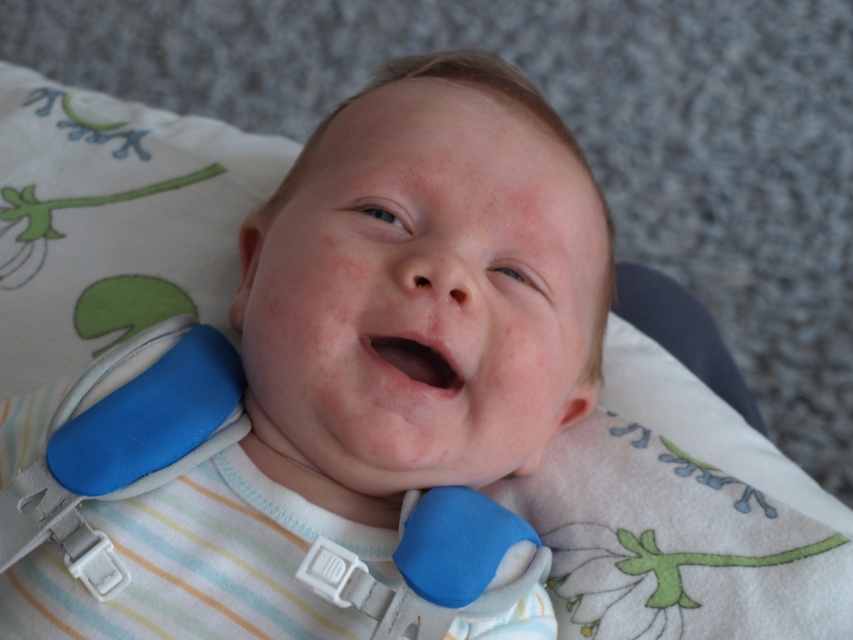
Question: Is blue foam baby at center to the left of blue foam strap at center from the viewer's perspective?

Choices:
 (A) no
 (B) yes

Answer: (A)

Question: Where is blue foam baby at center located in relation to smooth pink flesh at center in the image?

Choices:
 (A) left
 (B) right

Answer: (A)

Question: Which object appears farthest from the camera in this image?

Choices:
 (A) blue foam strap at center
 (B) smooth pink flesh at center
 (C) blue foam baby at center

Answer: (A)

Question: Which of these objects is positioned closest to the blue foam baby at center?

Choices:
 (A) blue foam strap at center
 (B) smooth pink flesh at center

Answer: (B)

Question: Which point is closer to the camera?

Choices:
 (A) (91, 404)
 (B) (419, 346)

Answer: (B)

Question: Can you confirm if blue foam strap at center is bigger than smooth pink flesh at center?

Choices:
 (A) no
 (B) yes

Answer: (B)